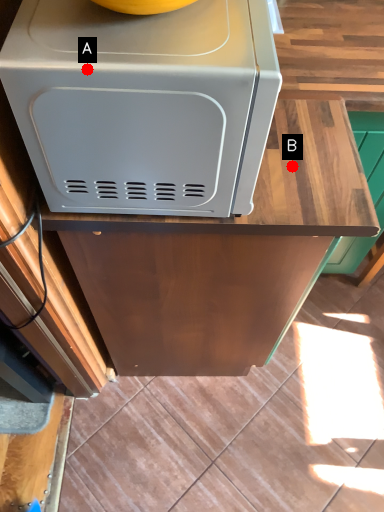
Question: Two points are circled on the image, labeled by A and B beside each circle. Which point is closer to the camera taking this photo?

Choices:
 (A) A is closer
 (B) B is closer

Answer: (A)